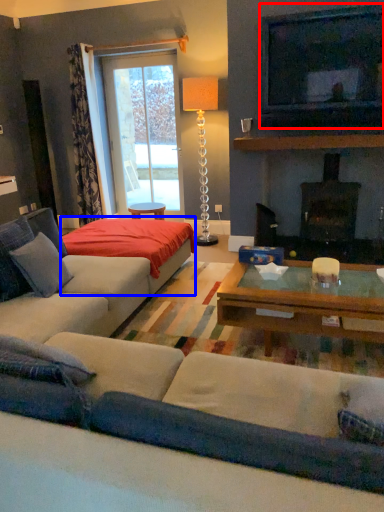
Question: Which object is further to the camera taking this photo, television (highlighted by a red box) or plain (highlighted by a blue box)?

Choices:
 (A) television
 (B) plain

Answer: (A)